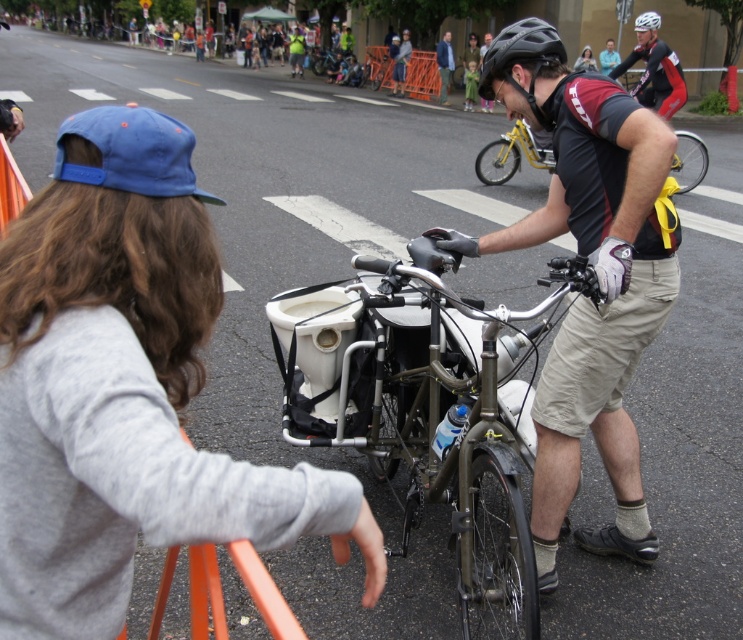
Is point (496, 141) positioned before point (452, 68)?

Yes, it is in front of point (452, 68).

At what (x,y) coordinates should I click in order to perform the action: click on yellow metallic bicycle at center. Please return your answer as a coordinate pair (x, y). Looking at the image, I should click on (510, 154).

Does metallic silver bicycle at center have a smaller size compared to black matte bicycle helmet at upper center?

Correct, metallic silver bicycle at center occupies less space than black matte bicycle helmet at upper center.

Between metallic silver bicycle at center and black matte bicycle helmet at upper center, which one has more height?

black matte bicycle helmet at upper center

Does point (507, 548) come closer to viewer compared to point (661, 20)?

That is True.

This screenshot has height=640, width=743. In order to click on metallic silver bicycle at center in this screenshot , I will do `click(438, 417)`.

Is blue denim jacket at upper center shorter than black matte bicycle helmet at upper center?

Correct, blue denim jacket at upper center is not as tall as black matte bicycle helmet at upper center.

Between point (444, 36) and point (658, 24), which one is positioned behind?

Positioned behind is point (444, 36).

This screenshot has width=743, height=640. In order to click on blue denim jacket at upper center in this screenshot , I will do `click(444, 65)`.